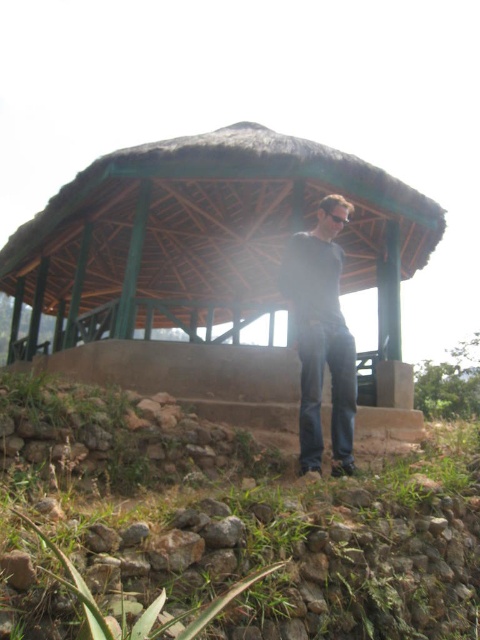
Between dark gray sweater at center and black plastic goggles at center, which one appears on the right side from the viewer's perspective?

black plastic goggles at center is more to the right.

Can you confirm if dark gray sweater at center is wider than black plastic goggles at center?

Yes.

Between point (299, 285) and point (346, 220), which one is positioned behind?

Point (346, 220)

At what (x,y) coordinates should I click in order to perform the action: click on dark gray sweater at center. Please return your answer as a coordinate pair (x, y). Image resolution: width=480 pixels, height=640 pixels. Looking at the image, I should click on (322, 337).

Between green wood gazebo at center and dark gray sweater at center, which one has more height?

Standing taller between the two is green wood gazebo at center.

Does green wood gazebo at center appear under dark gray sweater at center?

No, green wood gazebo at center is not below dark gray sweater at center.

Is point (129, 275) positioned behind point (331, 282)?

Yes, it is behind point (331, 282).

Locate an element on the screen. green wood gazebo at center is located at coordinates (206, 237).

Does green wood gazebo at center have a larger size compared to black plastic goggles at center?

Indeed, green wood gazebo at center has a larger size compared to black plastic goggles at center.

Between green wood gazebo at center and black plastic goggles at center, which one is positioned lower?

black plastic goggles at center is lower down.

Which is behind, point (350, 189) or point (347, 218)?

Point (350, 189)

Find the location of a particular element. This screenshot has height=640, width=480. green wood gazebo at center is located at coordinates pos(206,237).